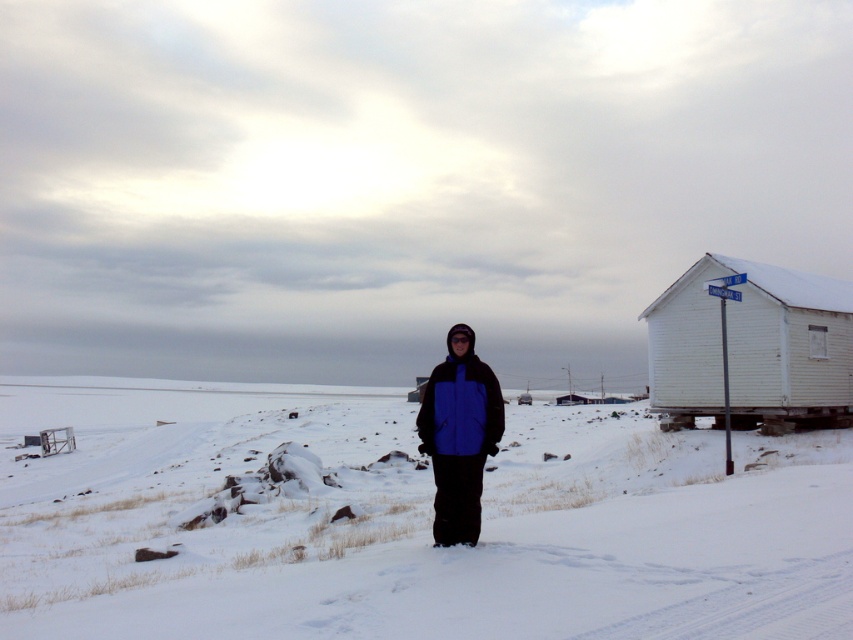
Question: From the image, what is the correct spatial relationship of white fluffy snow at center in relation to blue matte jacket at center?

Choices:
 (A) left
 (B) right

Answer: (A)

Question: Which of the following is the farthest from the observer?

Choices:
 (A) (440, 394)
 (B) (173, 536)
 (C) (664, 323)

Answer: (C)

Question: Is white fluffy snow at center to the right of blue matte jacket at center from the viewer's perspective?

Choices:
 (A) yes
 (B) no

Answer: (B)

Question: Which point is farther to the camera?

Choices:
 (A) white wooden hut at right
 (B) blue matte jacket at center

Answer: (A)

Question: Is white fluffy snow at center to the left of white wooden hut at right from the viewer's perspective?

Choices:
 (A) no
 (B) yes

Answer: (B)

Question: Which object appears closest to the camera in this image?

Choices:
 (A) white fluffy snow at center
 (B) white wooden hut at right

Answer: (A)